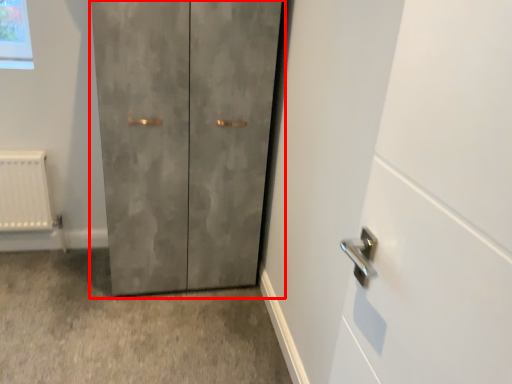
Question: In this image, where is door (annotated by the red box) located relative to concrete?

Choices:
 (A) right
 (B) left

Answer: (A)